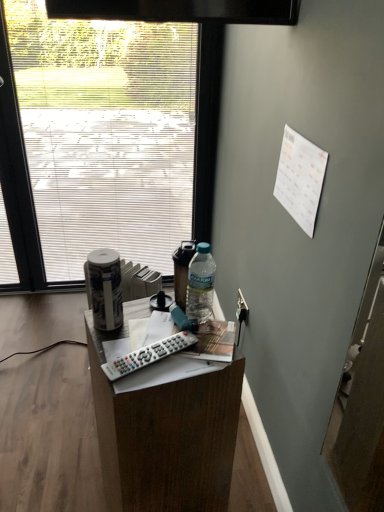
The height and width of the screenshot is (512, 384). Find the location of `blank space situated above wooden desk at center (from a real-world perspective)`. blank space situated above wooden desk at center (from a real-world perspective) is located at coordinates (153, 334).